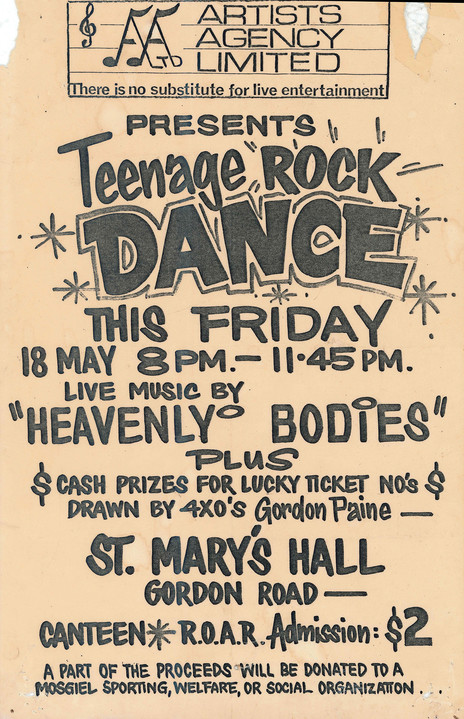
You are a GUI agent. You are given a task and a screenshot of the screen. Output one action in this format:
    pyautogui.click(x=<x>, y=<y>)
    Task: Click on the empty space at bottom of poster
    The width and height of the screenshot is (464, 719).
    Given the screenshot: What is the action you would take?
    pyautogui.click(x=224, y=705)